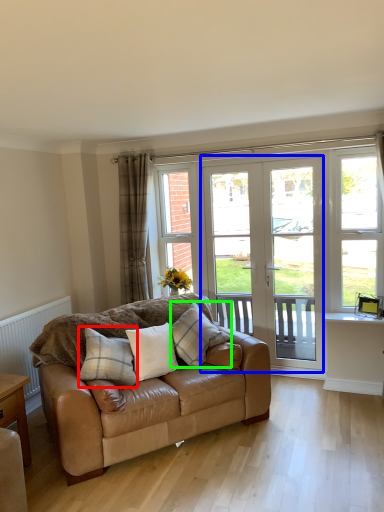
Question: Based on their relative distances, which object is farther from pillow (highlighted by a red box)? Choose from screen door (highlighted by a blue box) and pillow (highlighted by a green box).

Choices:
 (A) screen door
 (B) pillow

Answer: (A)